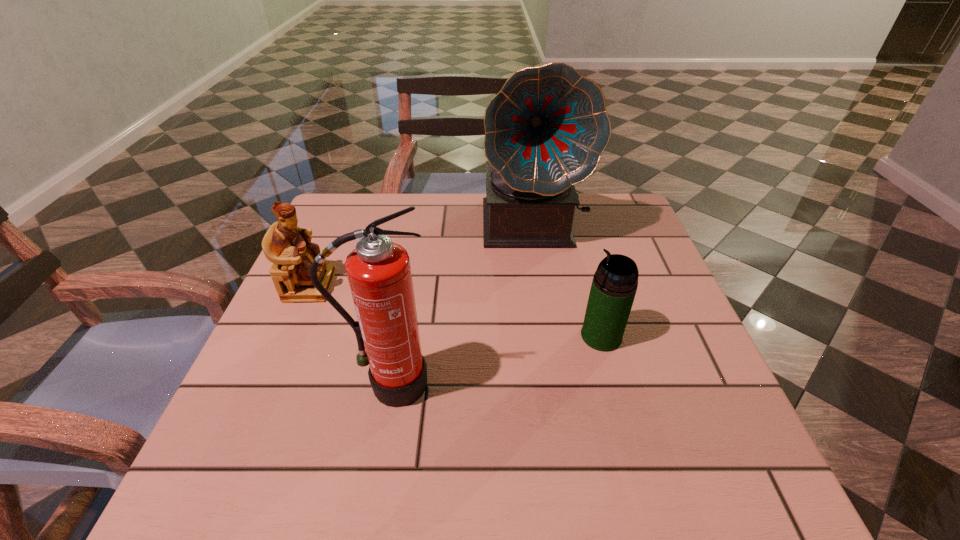
Where is `vacant region located 0.380m from the spout of the thermos bottle`? The image size is (960, 540). vacant region located 0.380m from the spout of the thermos bottle is located at coordinates (391, 336).

This screenshot has width=960, height=540. Identify the location of vacant space positioned 0.100m on the front-facing side of the third nearest object. (376, 286).

Where is `object that is at the far edge`? This screenshot has height=540, width=960. object that is at the far edge is located at coordinates (545, 131).

Identify the location of object that is at the left edge. The width and height of the screenshot is (960, 540). tap(289, 248).

Image resolution: width=960 pixels, height=540 pixels. What are the coordinates of `record player that is at the right edge` in the screenshot? It's located at (545, 131).

You are a GUI agent. You are given a task and a screenshot of the screen. Output one action in this format:
    pyautogui.click(x=<x>, y=<y>)
    Task: Click on the thermos bottle that is at the right edge
    Image resolution: width=960 pixels, height=540 pixels.
    Given the screenshot: What is the action you would take?
    pyautogui.click(x=615, y=282)

Where is `object at the far right corner`? This screenshot has height=540, width=960. object at the far right corner is located at coordinates coord(545,131).

This screenshot has height=540, width=960. I want to click on blank space at the far edge, so click(x=468, y=198).

This screenshot has width=960, height=540. I want to click on vacant position at the near edge of the desktop, so click(x=473, y=487).

This screenshot has width=960, height=540. Find the location of `vacant space at the left edge`. vacant space at the left edge is located at coordinates (287, 383).